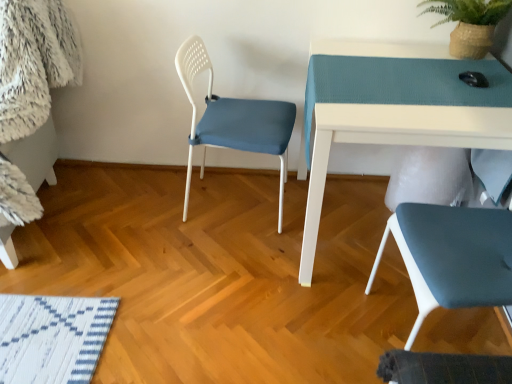
Image resolution: width=512 pixels, height=384 pixels. In order to click on vacant space underneath white glossy table at upper right (from a real-world perspective) in this screenshot , I will do `click(349, 223)`.